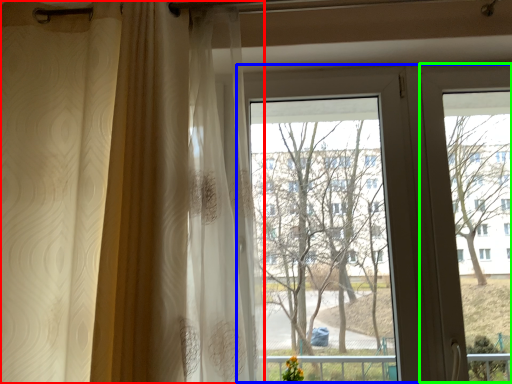
Question: Which object is positioned closest to curtain (highlighted by a red box)? Select from bay window (highlighted by a blue box) and screen door (highlighted by a green box).

Choices:
 (A) bay window
 (B) screen door

Answer: (A)